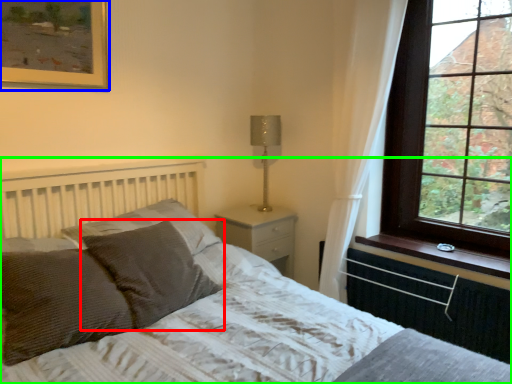
Question: Which is nearer to the pillow (highlighted by a red box)? picture frame (highlighted by a blue box) or bed (highlighted by a green box).

Choices:
 (A) picture frame
 (B) bed

Answer: (B)